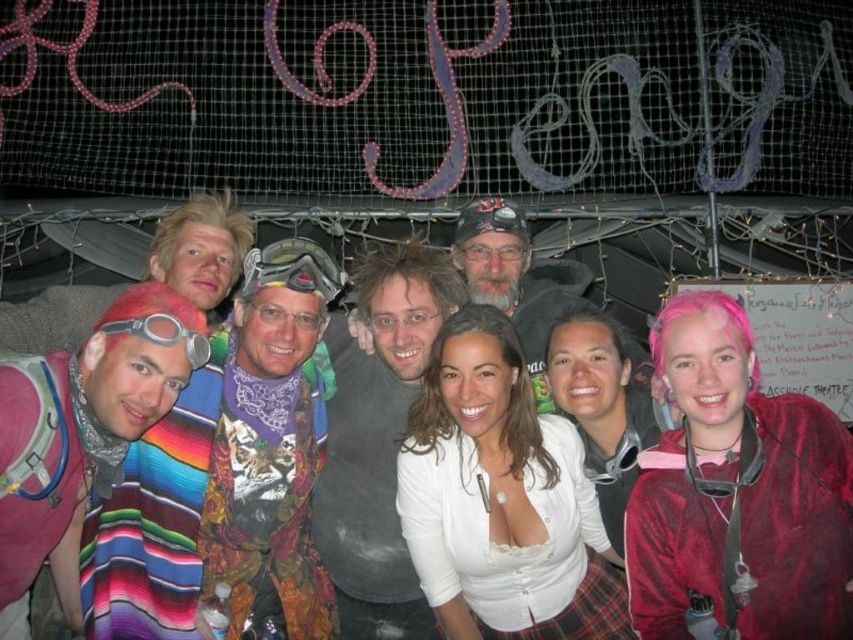
Does white lace top at center lie behind silver metallic goggles at left?

Yes, white lace top at center is behind silver metallic goggles at left.

Can you confirm if white lace top at center is shorter than silver metallic goggles at left?

Incorrect, white lace top at center's height does not fall short of silver metallic goggles at left's.

Which is behind, point (440, 460) or point (155, 337)?

Point (440, 460)

The height and width of the screenshot is (640, 853). In order to click on white lace top at center in this screenshot , I will do click(x=486, y=531).

Which is below, multicolored woven poncho at center left or matte black goggles at center?

multicolored woven poncho at center left

Who is positioned more to the right, multicolored woven poncho at center left or matte black goggles at center?

From the viewer's perspective, matte black goggles at center appears more on the right side.

Find the location of `multicolored woven poncho at center left`. multicolored woven poncho at center left is located at coordinates (213, 508).

Can you confirm if velvet red jacket at center is taller than multicolored woven blanket at center?

In fact, velvet red jacket at center may be shorter than multicolored woven blanket at center.

Is velvet red jacket at center further to camera compared to multicolored woven blanket at center?

No.

Is point (689, 524) farther from camera compared to point (106, 296)?

No, it is not.

The width and height of the screenshot is (853, 640). I want to click on velvet red jacket at center, so click(746, 529).